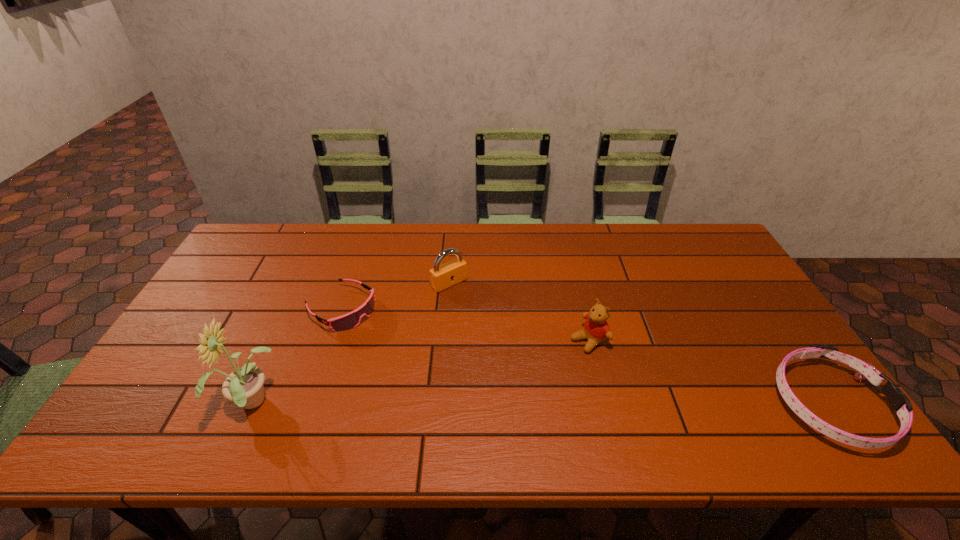
You are a GUI agent. You are given a task and a screenshot of the screen. Output one action in this format:
    pyautogui.click(x=<x>, y=<y>)
    Task: Click on the vacant area that lies between the rightmost object and the teddy bear
    The width and height of the screenshot is (960, 540).
    Given the screenshot: What is the action you would take?
    pyautogui.click(x=708, y=372)

The image size is (960, 540). In order to click on vacant point located between the tallest object and the padlock in this screenshot , I will do (x=352, y=344).

Where is `free space between the sunflower and the padlock`? free space between the sunflower and the padlock is located at coordinates (352, 344).

The width and height of the screenshot is (960, 540). What are the coordinates of `vacant area that lies between the goggles and the sunflower` in the screenshot? It's located at (298, 356).

Where is `vacant point located between the tallest object and the dog collar`? vacant point located between the tallest object and the dog collar is located at coordinates (541, 404).

You are a GUI agent. You are given a task and a screenshot of the screen. Output one action in this format:
    pyautogui.click(x=<x>, y=<y>)
    Task: Click on the free space between the teddy bear and the rightmost object
    The width and height of the screenshot is (960, 540).
    Given the screenshot: What is the action you would take?
    pyautogui.click(x=708, y=372)

Image resolution: width=960 pixels, height=540 pixels. What are the coordinates of `free space that is in between the third object from right to left and the teddy bear` in the screenshot? It's located at (519, 312).

Point out which object is positioned as the nearest to the second object from right to left. Please provide its 2D coordinates. Your answer should be formatted as a tuple, i.e. [(x, y)], where the tuple contains the x and y coordinates of a point satisfying the conditions above.

[(443, 276)]

Locate which object ranks third in proximity to the goggles. Please provide its 2D coordinates. Your answer should be formatted as a tuple, i.e. [(x, y)], where the tuple contains the x and y coordinates of a point satisfying the conditions above.

[(596, 329)]

At what (x,y) coordinates should I click in order to perform the action: click on vacant region that satisfies the following two spatial constraints: 1. on the front side of the rightmost object; 2. with the buckle on the second object from right to left. Please return your answer as a coordinate pair (x, y). This screenshot has width=960, height=540. Looking at the image, I should click on (605, 404).